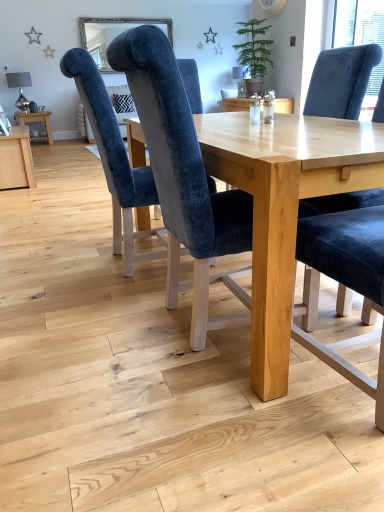
Question: Does velvet blue chair at center, acting as the 1th chair starting from the left, lie behind green matte potted plant at upper center?

Choices:
 (A) no
 (B) yes

Answer: (A)

Question: Is velvet blue chair at center, acting as the 1th chair starting from the left, outside of green matte potted plant at upper center?

Choices:
 (A) no
 (B) yes

Answer: (B)

Question: Considering the relative sizes of velvet blue chair at center, acting as the third chair starting from the right, and green matte potted plant at upper center in the image provided, is velvet blue chair at center, acting as the third chair starting from the right, taller than green matte potted plant at upper center?

Choices:
 (A) yes
 (B) no

Answer: (A)

Question: Is velvet blue chair at center, acting as the 1th chair starting from the left, positioned far away from green matte potted plant at upper center?

Choices:
 (A) no
 (B) yes

Answer: (B)

Question: Can you confirm if velvet blue chair at center, acting as the third chair starting from the right, is positioned to the left of green matte potted plant at upper center?

Choices:
 (A) no
 (B) yes

Answer: (B)

Question: From their relative heights in the image, would you say matte wooden table at left, the 1th table positioned from the top, is taller or shorter than green matte potted plant at upper center?

Choices:
 (A) tall
 (B) short

Answer: (B)

Question: From a real-world perspective, is matte wooden table at left, which ranks as the 2th table in front-to-back order, physically located above or below green matte potted plant at upper center?

Choices:
 (A) below
 (B) above

Answer: (A)

Question: Which is correct: matte wooden table at left, the second table when ordered from bottom to top, is inside green matte potted plant at upper center, or outside of it?

Choices:
 (A) inside
 (B) outside

Answer: (B)

Question: Would you say matte wooden table at left, which ranks as the 2th table in front-to-back order, is to the left or to the right of green matte potted plant at upper center in the picture?

Choices:
 (A) left
 (B) right

Answer: (A)

Question: In the image, is velvet blue chair at center, positioned as the 2th chair in right-to-left order, positioned in front of or behind green matte potted plant at upper center?

Choices:
 (A) behind
 (B) front

Answer: (B)

Question: From the image's perspective, is velvet blue chair at center, arranged as the second chair when viewed from the left, located above or below green matte potted plant at upper center?

Choices:
 (A) below
 (B) above

Answer: (A)

Question: From a real-world perspective, is velvet blue chair at center, arranged as the second chair when viewed from the left, positioned above or below green matte potted plant at upper center?

Choices:
 (A) below
 (B) above

Answer: (A)

Question: Considering the positions of velvet blue chair at center, arranged as the second chair when viewed from the left, and green matte potted plant at upper center in the image, is velvet blue chair at center, arranged as the second chair when viewed from the left, bigger or smaller than green matte potted plant at upper center?

Choices:
 (A) small
 (B) big

Answer: (B)

Question: Relative to velvet blue chair at center, positioned as the 2th chair in right-to-left order, is light wood table at center, which is the 1th table in bottom-to-top order, in front or behind?

Choices:
 (A) front
 (B) behind

Answer: (A)

Question: Is light wood table at center, which appears as the 2th table when viewed from the back, taller or shorter than velvet blue chair at center, positioned as the 2th chair in right-to-left order?

Choices:
 (A) short
 (B) tall

Answer: (A)